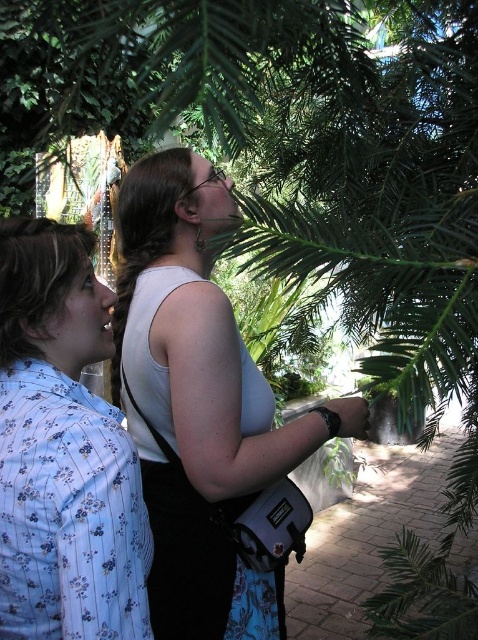
Who is shorter, white matte tank top at center or blue floral shirt at left?

Standing shorter between the two is blue floral shirt at left.

In the scene shown: Does white matte tank top at center have a smaller size compared to blue floral shirt at left?

Incorrect, white matte tank top at center is not smaller in size than blue floral shirt at left.

The height and width of the screenshot is (640, 478). Identify the location of white matte tank top at center. (199, 404).